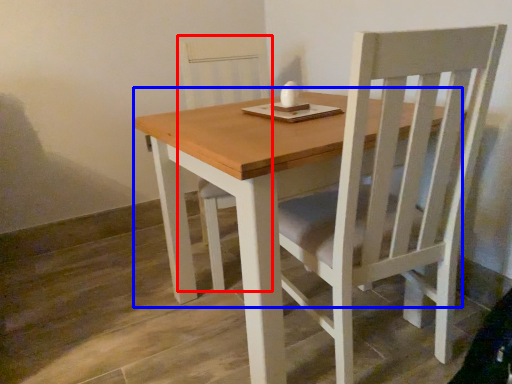
Question: Which point is further to the camera, chair (highlighted by a red box) or round table (highlighted by a blue box)?

Choices:
 (A) chair
 (B) round table

Answer: (A)